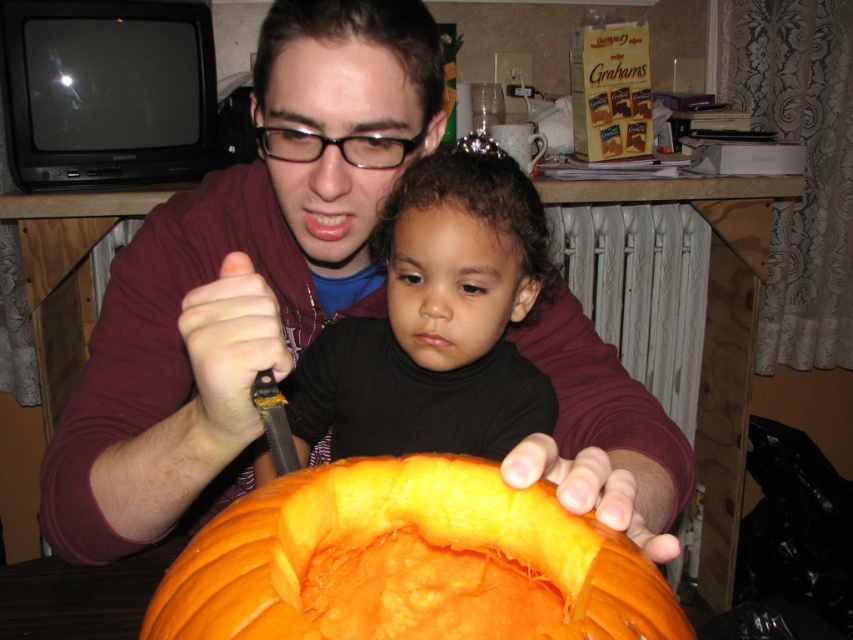
Does point (128, 310) come in front of point (497, 483)?

No, (128, 310) is further to viewer.

Find the location of `matte maroon hoodie at center`. matte maroon hoodie at center is located at coordinates (241, 276).

You are a GUI agent. You are given a task and a screenshot of the screen. Output one action in this format:
    pyautogui.click(x=<x>, y=<y>)
    Task: Click on the matte maroon hoodie at center
    The width and height of the screenshot is (853, 640).
    Given the screenshot: What is the action you would take?
    pyautogui.click(x=241, y=276)

Does matte maroon hoodie at center have a larger size compared to black matte baby at center?

Yes, matte maroon hoodie at center is bigger than black matte baby at center.

Does matte maroon hoodie at center have a lesser width compared to black matte baby at center?

No.

Image resolution: width=853 pixels, height=640 pixels. Find the location of `matte maroon hoodie at center`. matte maroon hoodie at center is located at coordinates (241, 276).

Who is more forward, (471, 474) or (445, 304)?

Positioned in front is point (471, 474).

Who is higher up, orange smooth pumpkin at center or black matte baby at center?

black matte baby at center is higher up.

What are the coordinates of `orange smooth pumpkin at center` in the screenshot? It's located at (425, 538).